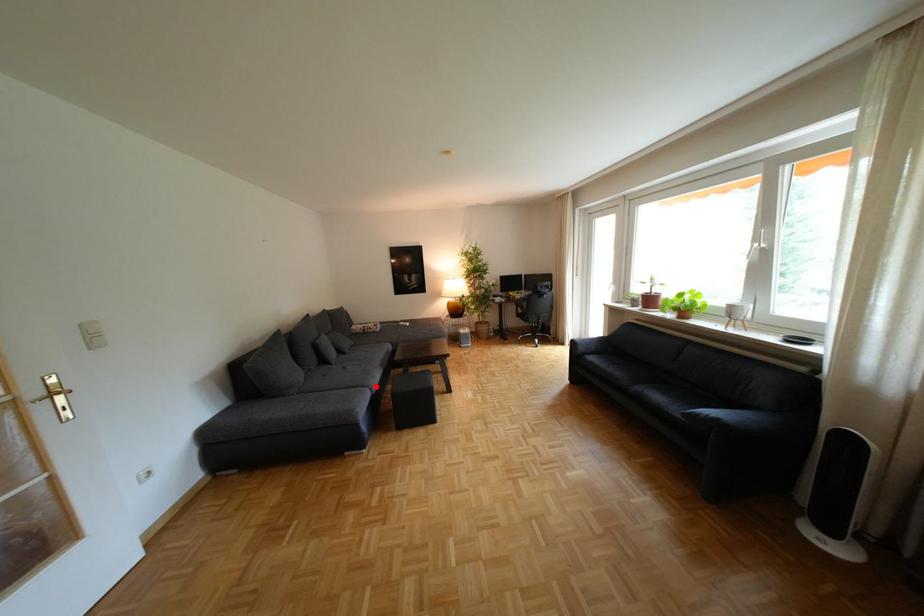
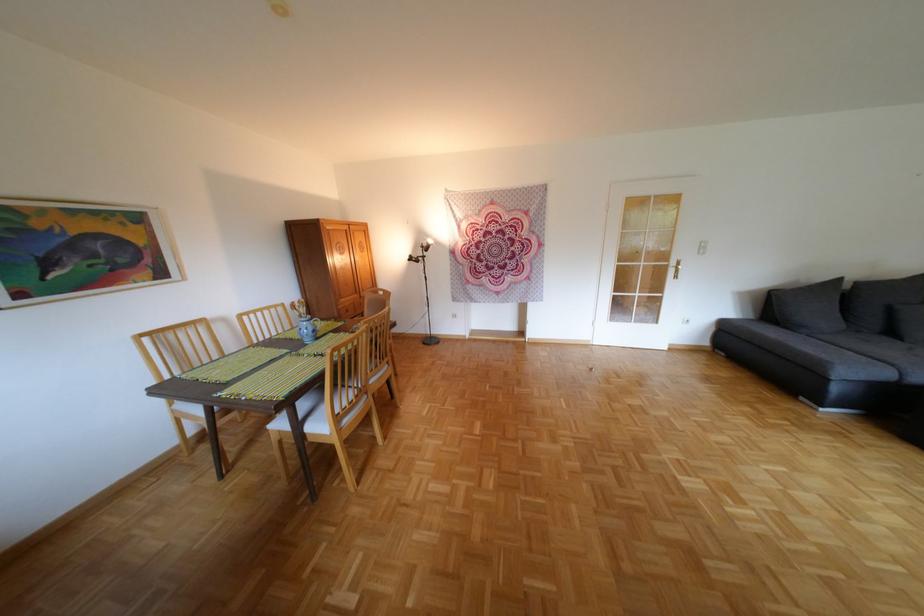
Find the pixel in the second image that matches the highlighted location in the first image.

(906, 365)